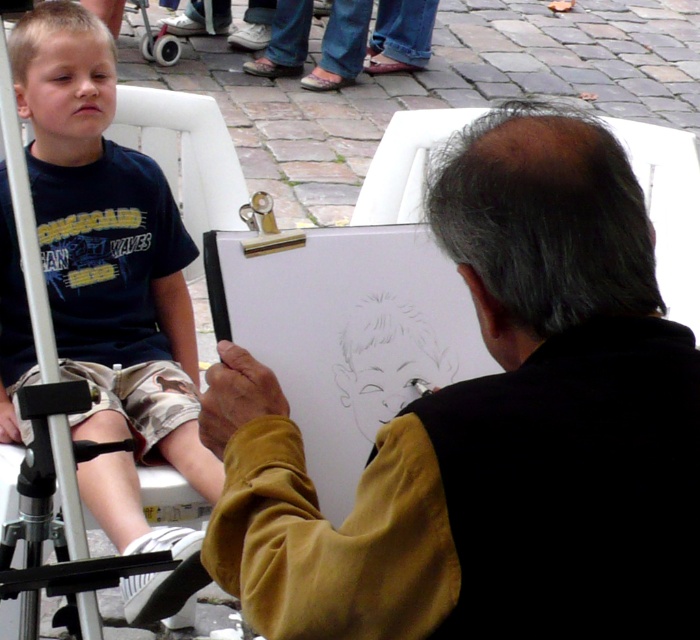
You are an artist who wants to place a smooth black jacket at center on the canvas. According to the scene, where should you place it on the canvas?

The smooth black jacket at center should be placed at point (494, 429) on the canvas.

You are an artist who needs to choose between placing a smooth black jacket at center or matte black shorts at left on a narrow shelf. Which object would you choose to ensure it fits?

The smooth black jacket at center is wider than the matte black shorts at left, so you should choose the matte black shorts at left to ensure it fits on the narrow shelf.